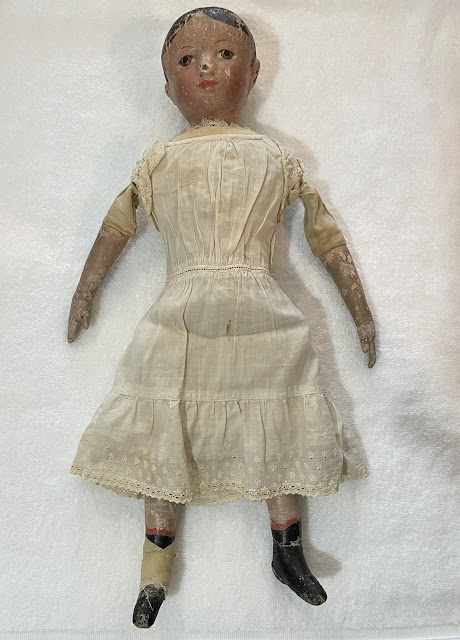
At what (x,y) coordinates should I click in order to perform the action: click on doll. Please return your answer as a coordinate pair (x, y). Looking at the image, I should click on (220, 205).